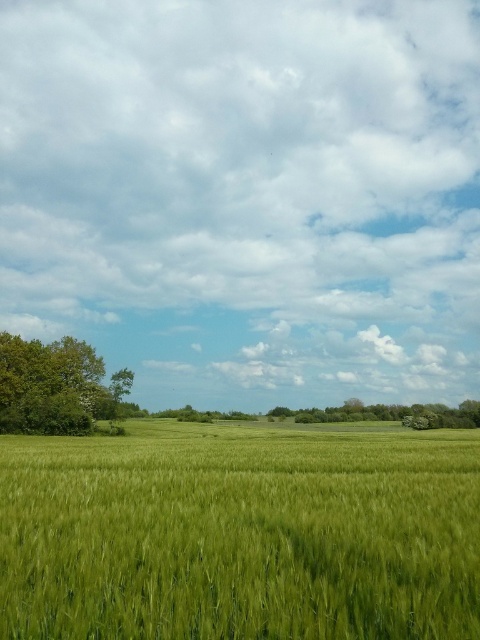
You are a farmer assessing the health of your trees. You notice two trees in your wheat field scene. Which tree has a narrower trunk, the green leafy tree at left or the green leafy tree at center?

The green leafy tree at left is thinner than the green leafy tree at center, so the green leafy tree at left has a narrower trunk.